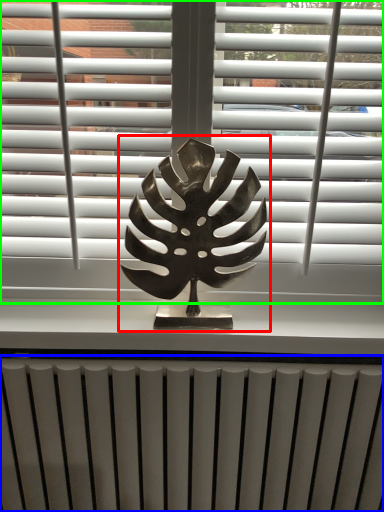
Question: Considering the real-world distances, which object is farthest from bronze statue (highlighted by a red box)? radiator (highlighted by a blue box) or window blind (highlighted by a green box)?

Choices:
 (A) radiator
 (B) window blind

Answer: (A)